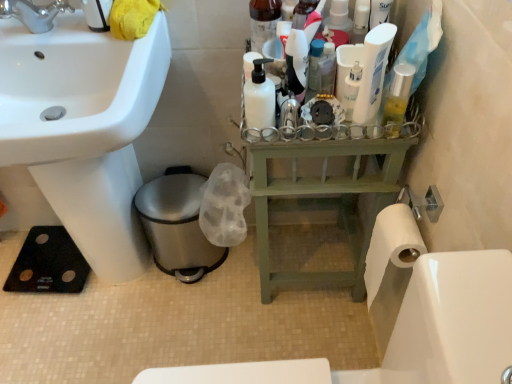
Where is `free spot in front of green wood balustrade at center`? free spot in front of green wood balustrade at center is located at coordinates (312, 333).